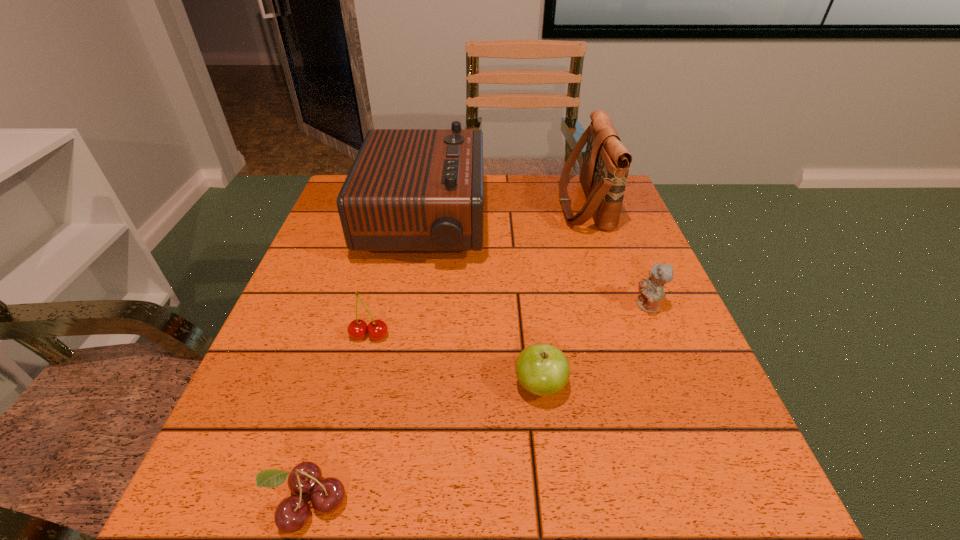
Image resolution: width=960 pixels, height=540 pixels. Find the location of `vacant space located 0.180m on the tuning display of the radio receiver`. vacant space located 0.180m on the tuning display of the radio receiver is located at coordinates (553, 224).

Locate an element on the screen. The image size is (960, 540). free space located on the front-facing side of the third farthest object is located at coordinates (597, 306).

Find the location of a particular element. The height and width of the screenshot is (540, 960). vacant space located on the front-facing side of the third farthest object is located at coordinates (592, 306).

Where is `free location located on the front-facing side of the third farthest object`? The height and width of the screenshot is (540, 960). free location located on the front-facing side of the third farthest object is located at coordinates (534, 306).

Where is `free space located 0.170m on the front of the third object from right to left`? The width and height of the screenshot is (960, 540). free space located 0.170m on the front of the third object from right to left is located at coordinates (557, 518).

Image resolution: width=960 pixels, height=540 pixels. I want to click on vacant area situated with the stems of the farther cherry pointing upwards, so click(x=352, y=404).

Locate an element on the screen. The height and width of the screenshot is (540, 960). shoulder bag situated at the far edge is located at coordinates (606, 163).

Where is `radio receiver positioned at the far edge`? The height and width of the screenshot is (540, 960). radio receiver positioned at the far edge is located at coordinates (408, 190).

What are the coordinates of `object that is positioned at the near edge` in the screenshot? It's located at (327, 495).

Identify the location of radio receiver that is positioned at the left edge. (408, 190).